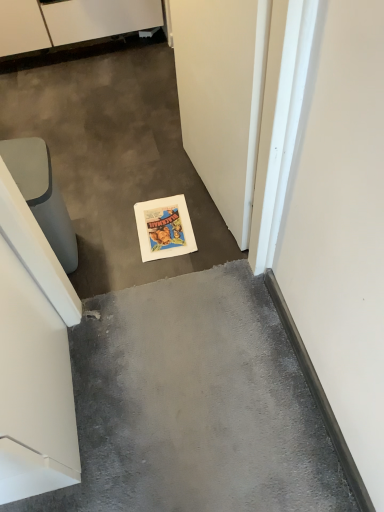
Question: From the image's perspective, is white matte door at lower center beneath white glossy cabinet at upper left?

Choices:
 (A) yes
 (B) no

Answer: (A)

Question: Is white matte door at lower center in contact with white glossy cabinet at upper left?

Choices:
 (A) yes
 (B) no

Answer: (B)

Question: From a real-world perspective, is white matte door at lower center under white glossy cabinet at upper left?

Choices:
 (A) yes
 (B) no

Answer: (B)

Question: Is white matte door at lower center behind white glossy cabinet at upper left?

Choices:
 (A) no
 (B) yes

Answer: (A)

Question: Considering the relative positions of white matte door at lower center and white glossy cabinet at upper left in the image provided, is white matte door at lower center to the right of white glossy cabinet at upper left from the viewer's perspective?

Choices:
 (A) no
 (B) yes

Answer: (B)

Question: Does point (21, 172) appear closer or farther from the camera than point (13, 0)?

Choices:
 (A) closer
 (B) farther

Answer: (A)

Question: Considering the positions of matte gray trash can at left and white glossy cabinet at upper left in the image, is matte gray trash can at left bigger or smaller than white glossy cabinet at upper left?

Choices:
 (A) big
 (B) small

Answer: (B)

Question: Is matte gray trash can at left wider or thinner than white glossy cabinet at upper left?

Choices:
 (A) wide
 (B) thin

Answer: (B)

Question: Do you think matte gray trash can at left is within white glossy cabinet at upper left, or outside of it?

Choices:
 (A) inside
 (B) outside

Answer: (B)

Question: Does point (251, 14) appear closer or farther from the camera than point (16, 25)?

Choices:
 (A) farther
 (B) closer

Answer: (B)

Question: Is white matte door at lower center in front of or behind white glossy cabinet at upper left in the image?

Choices:
 (A) behind
 (B) front

Answer: (B)

Question: Would you say white matte door at lower center is to the left or to the right of white glossy cabinet at upper left in the picture?

Choices:
 (A) left
 (B) right

Answer: (B)

Question: Which is correct: white matte door at lower center is inside white glossy cabinet at upper left, or outside of it?

Choices:
 (A) outside
 (B) inside

Answer: (A)

Question: From the image's perspective, is matte gray trash can at left located above or below white matte door at lower center?

Choices:
 (A) below
 (B) above

Answer: (A)

Question: Is matte gray trash can at left taller or shorter than white matte door at lower center?

Choices:
 (A) tall
 (B) short

Answer: (B)